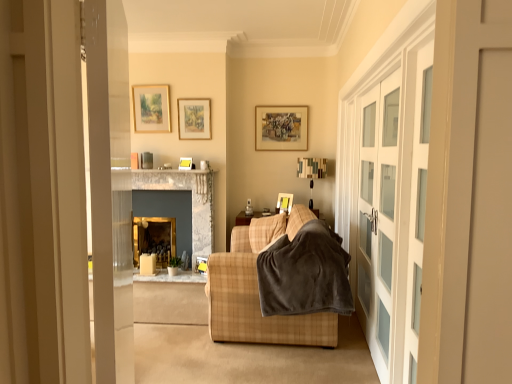
Question: From the image's perspective, relative to matte wooden picture frame at upper center, placed as the 6th picture frame when sorted from bottom to top, is gold metallic fireplace at center, acting as the 2th fireplace starting from the left, above or below?

Choices:
 (A) above
 (B) below

Answer: (B)

Question: In the image, is gold metallic fireplace at center, the 1th fireplace when ordered from right to left, on the left side or the right side of matte wooden picture frame at upper center, placed as the 6th picture frame when sorted from bottom to top?

Choices:
 (A) left
 (B) right

Answer: (A)

Question: Which object is the farthest from the wooden picture frame at upper center, arranged as the 5th picture frame when viewed from the left?

Choices:
 (A) plaid fabric couch at center
 (B) matte yellow picture frame at center, which ranks as the second picture frame in bottom-to-top order
 (C) clear glass cabinet at right, positioned as the 1th screen door in back-to-front order
 (D) gold metallic fireplace at center, acting as the 2th fireplace starting from the left
 (E) velvety brown blanket at center

Answer: (E)

Question: Based on their relative distances, which object is farther from the matte yellow picture frame at center, marked as the third picture frame in a bottom-to-top arrangement?

Choices:
 (A) gold metallic fireplace at center, the 1th fireplace when ordered from right to left
 (B) wooden picture frame at center, the 6th picture frame when ordered from top to bottom
 (C) white glass cabinet doors at right, the second screen door from the back
 (D) velvety brown blanket at center
 (E) matte wooden picture frame at upper center, placed as the sixth picture frame when sorted from right to left

Answer: (C)